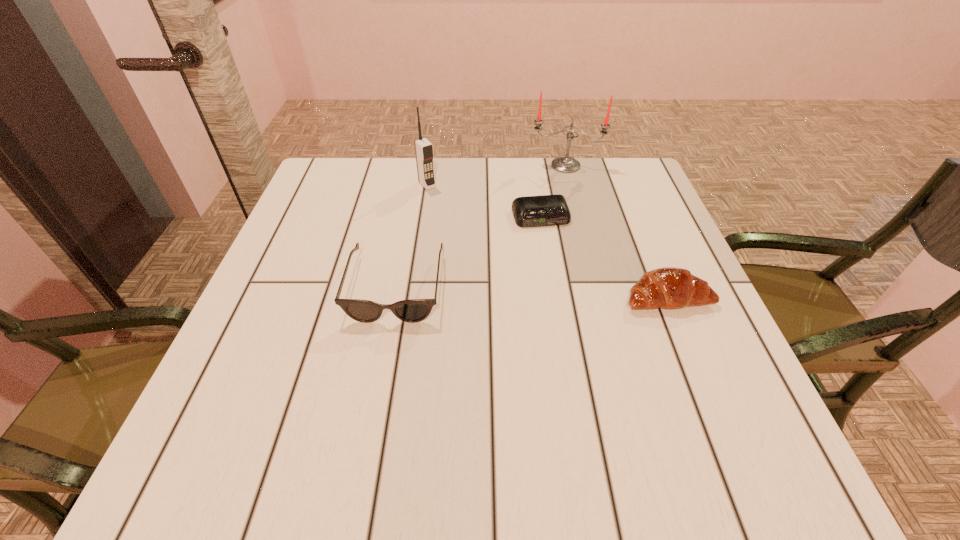
This screenshot has height=540, width=960. In order to click on sunglasses in this screenshot , I will do `click(414, 310)`.

Identify the location of crescent roll. (669, 287).

Identify the location of cellular telephone. This screenshot has height=540, width=960. (424, 153).

Image resolution: width=960 pixels, height=540 pixels. What are the coordinates of `candle` in the screenshot? It's located at (565, 164).

The image size is (960, 540). Find the location of `the third nearest object`. the third nearest object is located at coordinates (532, 211).

The height and width of the screenshot is (540, 960). I want to click on alarm clock, so click(532, 211).

I want to click on vacant space located 0.170m on the front lenses of the sunglasses, so click(374, 405).

Find the location of `vacant space situated on the back of the crescent roll`. vacant space situated on the back of the crescent roll is located at coordinates (646, 246).

Where is `free space located 0.270m on the front-facing side of the fourth nearest object`? The width and height of the screenshot is (960, 540). free space located 0.270m on the front-facing side of the fourth nearest object is located at coordinates coord(487,247).

At what (x,y) coordinates should I click in order to perform the action: click on free space located on the front-facing side of the fourth nearest object. Please return your answer as a coordinate pair (x, y). Image resolution: width=960 pixels, height=540 pixels. Looking at the image, I should click on (504, 266).